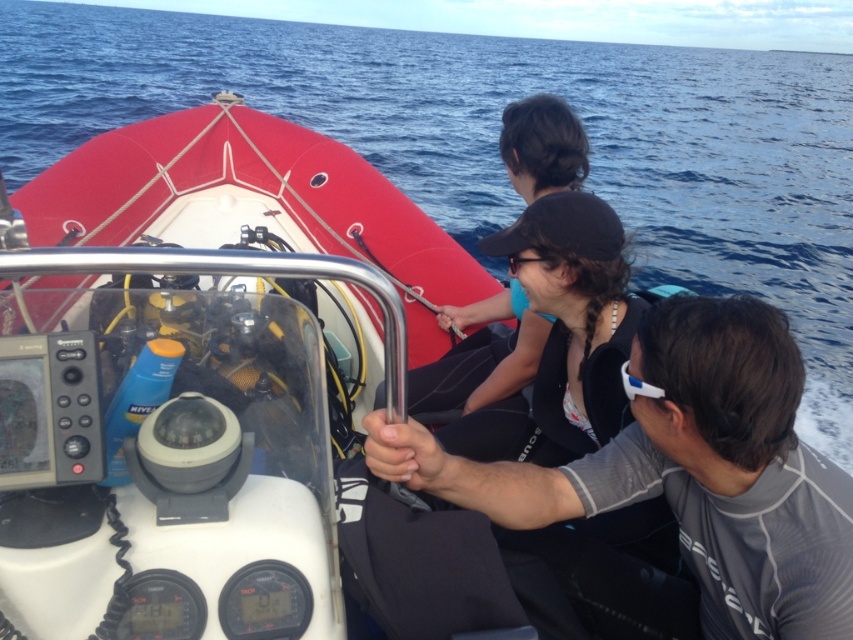
Question: Where is blue water at center located in relation to gray matte wetsuit at center in the image?

Choices:
 (A) left
 (B) right

Answer: (B)

Question: Does white matte boat at center appear on the left side of black matte wetsuit at center?

Choices:
 (A) yes
 (B) no

Answer: (A)

Question: Is blue water at center wider than black matte wetsuit at center?

Choices:
 (A) yes
 (B) no

Answer: (A)

Question: Estimate the real-world distances between objects in this image. Which object is closer to the blue water at center?

Choices:
 (A) gray matte wetsuit at center
 (B) white matte boat at center

Answer: (A)

Question: Which point is farther from the camera taking this photo?

Choices:
 (A) (714, 144)
 (B) (229, 403)
 (C) (842, 616)
 (D) (537, 179)

Answer: (A)

Question: Among these objects, which one is farthest from the camera?

Choices:
 (A) black matte wetsuit at center
 (B) gray matte wetsuit at center
 (C) white matte boat at center
 (D) blue water at center

Answer: (C)